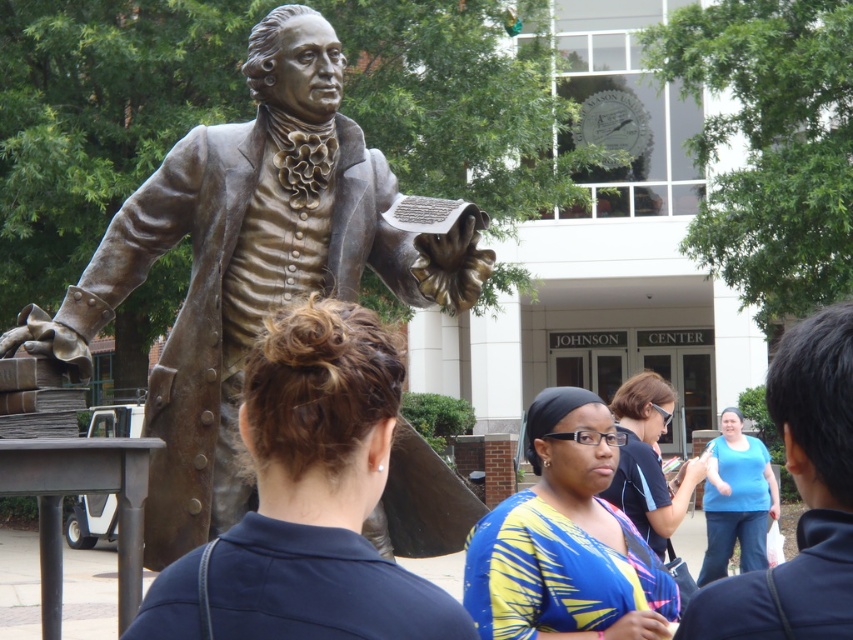
Question: Which object is farther from the camera taking this photo?

Choices:
 (A) blue printed shirt at center
 (B) blue cotton shirt at center
 (C) bronze statue at left
 (D) dark brown hair at center

Answer: (B)

Question: From the image, what is the correct spatial relationship of blue printed blouse at center in relation to blue shirt at right?

Choices:
 (A) left
 (B) right

Answer: (A)

Question: Can you confirm if dark brown hair at center is wider than blue printed shirt at center?

Choices:
 (A) no
 (B) yes

Answer: (A)

Question: Which of the following is the farthest from the observer?

Choices:
 (A) blue printed blouse at center
 (B) blue shirt at right
 (C) bronze statue at left
 (D) blue cotton shirt at center

Answer: (D)

Question: Does bronze statue at left come in front of blue cotton shirt at center?

Choices:
 (A) no
 (B) yes

Answer: (B)

Question: Considering the real-world distances, which object is farthest from the bronze statue at left?

Choices:
 (A) blue cotton shirt at center
 (B) blue printed blouse at center

Answer: (A)